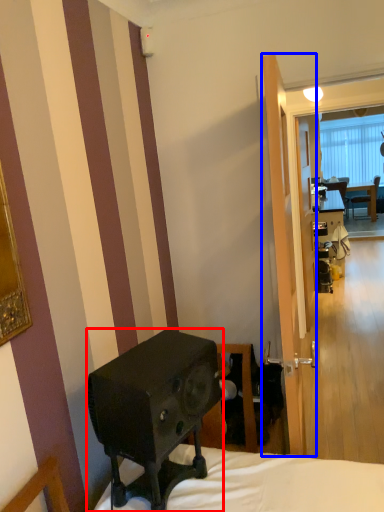
Question: Among these objects, which one is farthest to the camera, loudspeaker (highlighted by a red box) or screen door (highlighted by a blue box)?

Choices:
 (A) loudspeaker
 (B) screen door

Answer: (B)